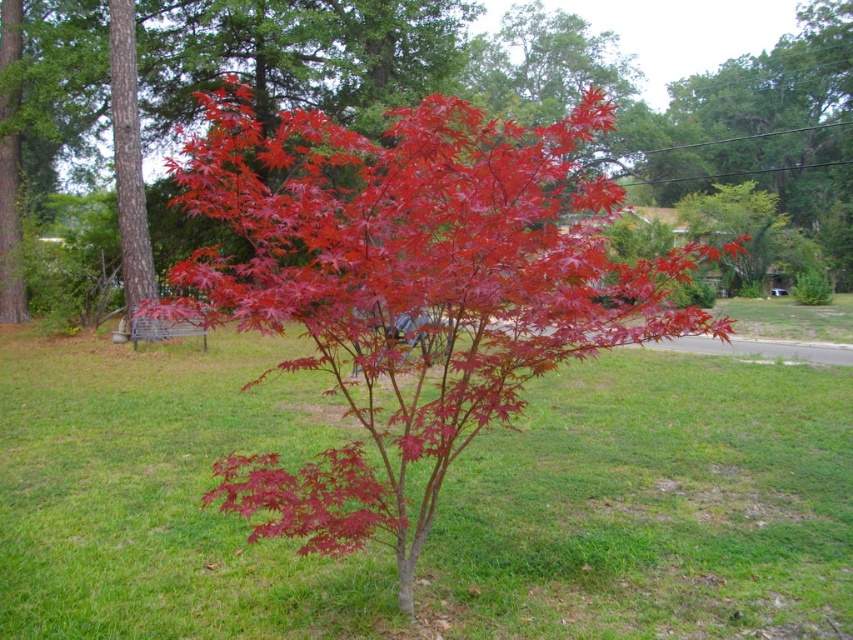
You are standing in the yard and want to walk from the green grass at center to the glossy red maple at center. Which direction should you move to get closer to the maple?

Since the green grass at center is further to the viewer than the glossy red maple at center, you should move forward towards the glossy red maple at center to get closer to it.

Based on the photo, you are standing in the grassy yard looking at the glossy red maple at center and the glossy red maple leaf at center. Which object is nearer to you?

Result: The glossy red maple at center is closer to the viewer than the glossy red maple leaf at center.

You are standing in the grassy yard looking at the vibrant red Japanese maple tree. There is a point marked at coordinates [409,291]. What does this point represent?

The point at coordinates [409,291] marks the glossy red maple at center.